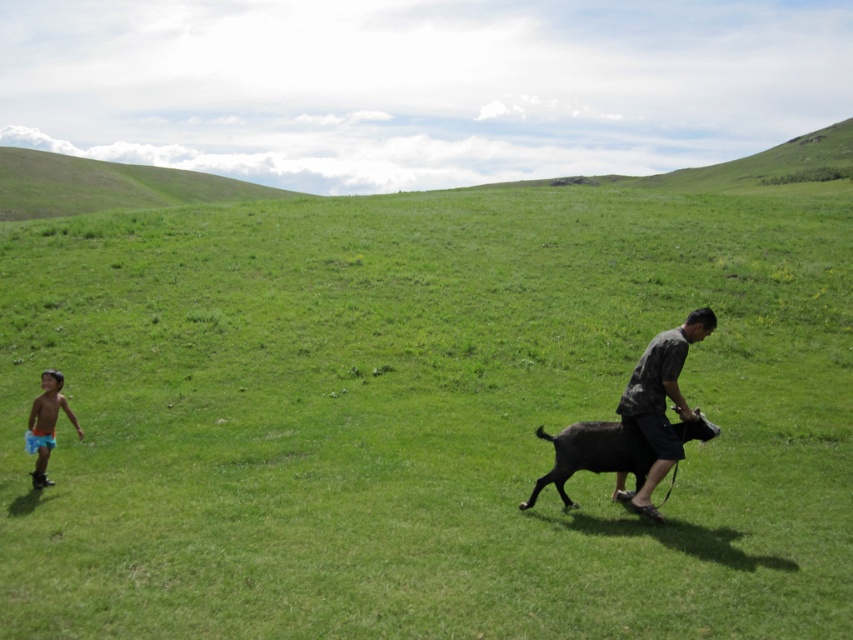
Does green grassy field at center lie behind camouflage fabric shirt at right?

No.

Is green grassy field at center taller than camouflage fabric shirt at right?

Correct, green grassy field at center is much taller as camouflage fabric shirt at right.

Who is more distant from viewer, (520, 608) or (703, 308)?

Point (703, 308)

The image size is (853, 640). Identify the location of green grassy field at center. (422, 417).

Where is `green grassy field at center`? The image size is (853, 640). green grassy field at center is located at coordinates (422, 417).

Does green grassy field at center have a greater width compared to blue shorts at lower left?

Indeed, green grassy field at center has a greater width compared to blue shorts at lower left.

Who is more forward, (756, 365) or (44, 474)?

Point (44, 474) is in front.

Locate an element on the screen. green grassy field at center is located at coordinates (422, 417).

Which is in front, point (561, 273) or point (102, 189)?

Point (561, 273) is in front.

Does green grassy field at center appear under green grassy hillside at upper left?

Yes.

Between point (375, 220) and point (28, 156), which one is positioned behind?

The point (28, 156) is behind.

In order to click on green grassy field at center in this screenshot , I will do `click(422, 417)`.